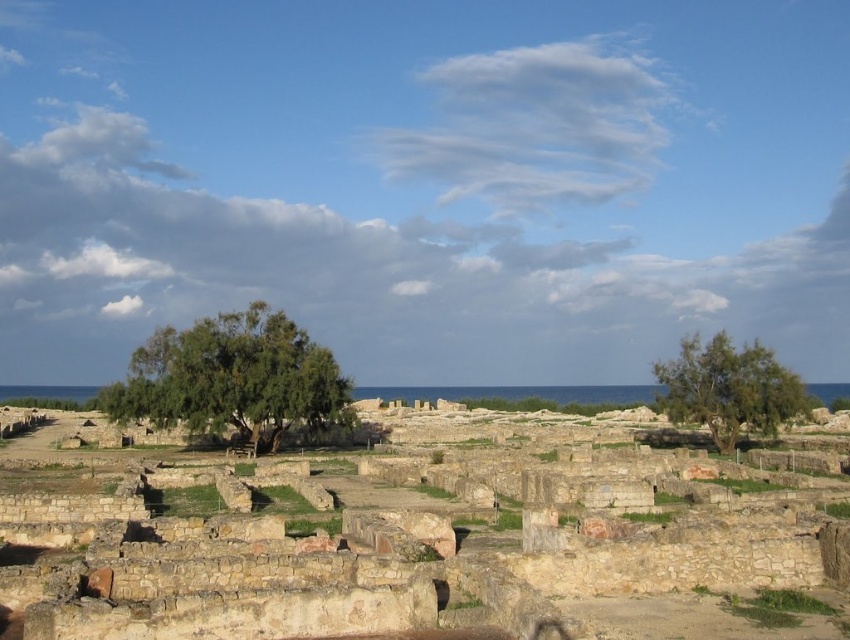
Question: Can you confirm if brown stone amphitheater at center is positioned to the left of green leafy tree at center?

Choices:
 (A) no
 (B) yes

Answer: (A)

Question: Is brown stone amphitheater at center bigger than green leafy tree at right?

Choices:
 (A) yes
 (B) no

Answer: (A)

Question: Does brown stone amphitheater at center come behind green leafy tree at right?

Choices:
 (A) no
 (B) yes

Answer: (A)

Question: Which object is positioned closest to the green leafy tree at center?

Choices:
 (A) brown stone amphitheater at center
 (B) green leafy tree at right

Answer: (A)

Question: Which point is closer to the camera?

Choices:
 (A) green leafy tree at center
 (B) green leafy tree at right
 (C) brown stone amphitheater at center

Answer: (C)

Question: Which is nearer to the green leafy tree at right?

Choices:
 (A) brown stone amphitheater at center
 (B) green leafy tree at center

Answer: (A)